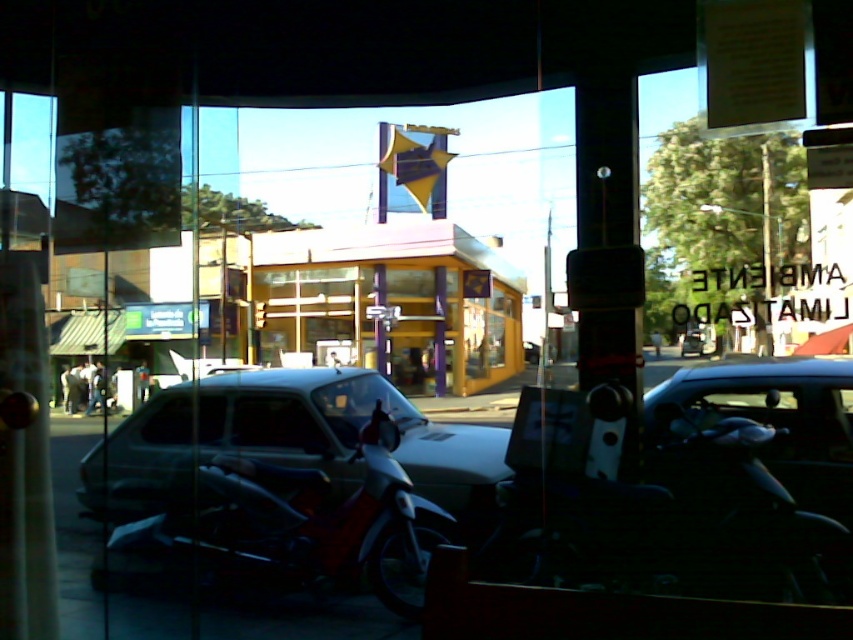
You are standing inside the building looking out through the glass. There is a point marked at coordinates (285, 440). Which object does this point belong to?

The point at coordinates (285, 440) is on the white matte car at center.

Based on the photo, you are standing inside the building looking out through the glass. There are two points marked on the glass at coordinates point (457, 460) and point (323, 576). Which point is closer to you?

Point (457, 460) is further to the viewer than point (323, 576), so the point closer to you is point (323, 576).